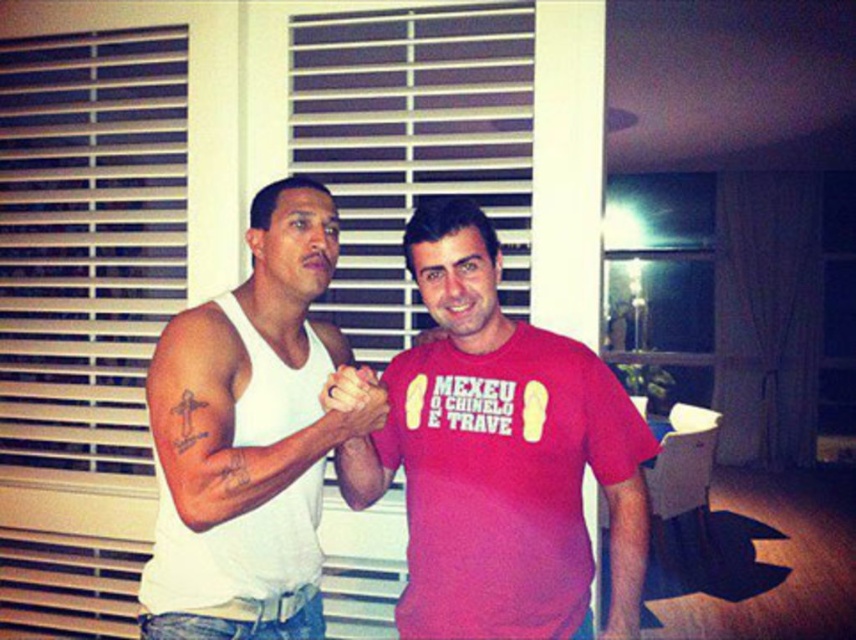
You are a painter standing in the living room and want to paint the white smooth muscle at upper left and the white matte arm at center. Which object should you paint first if you want to start with the one closer to your left side?

The white smooth muscle at upper left should be painted first because it is positioned to the left of the white matte arm at center, making it closer to your left side.